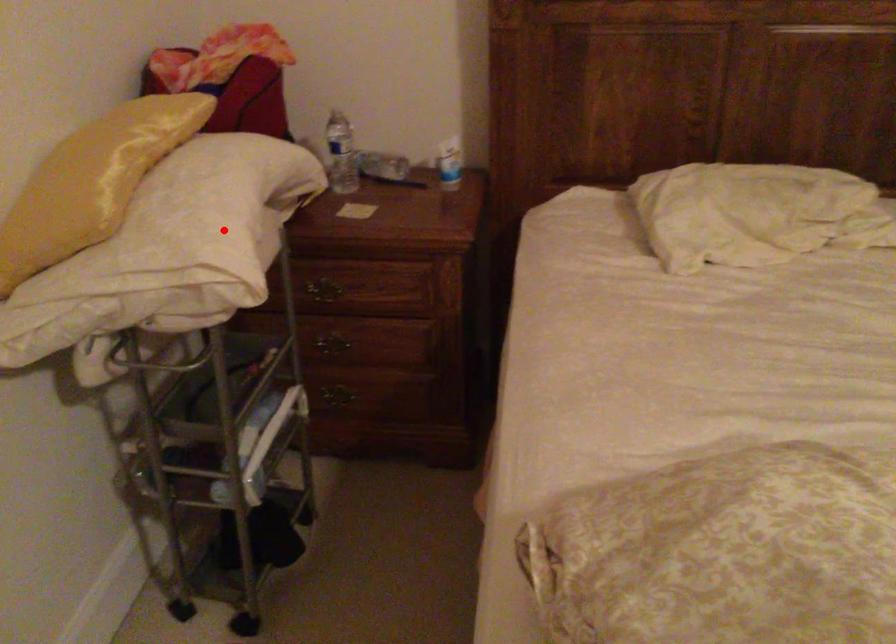
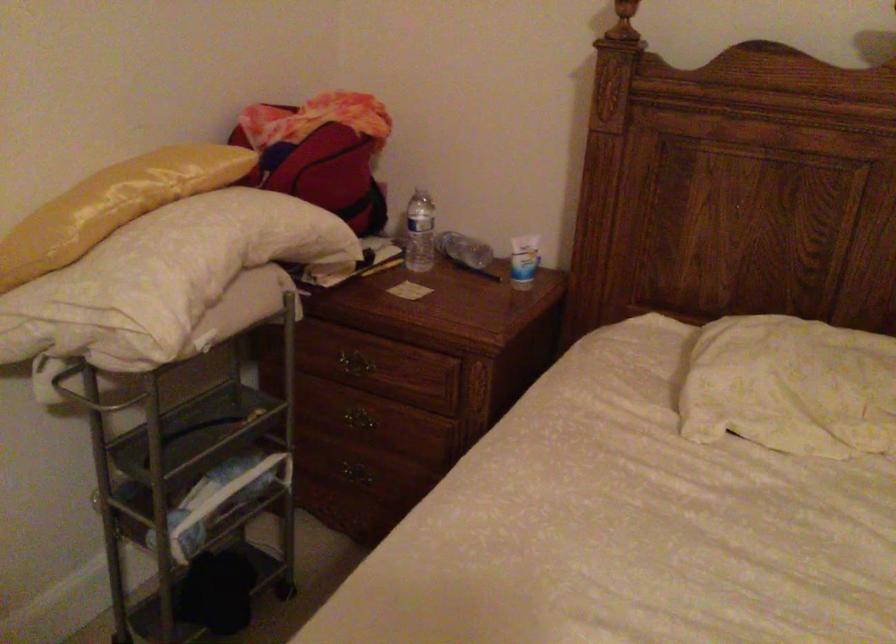
Find the pixel in the second image that matches the highlighted location in the first image.

(164, 278)